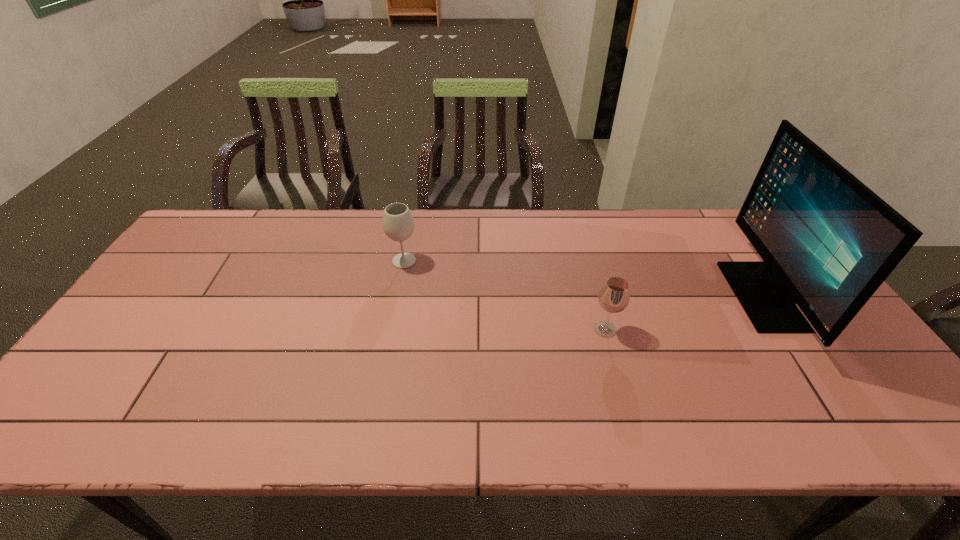
Image resolution: width=960 pixels, height=540 pixels. In order to click on the tallest object in this screenshot , I will do `click(828, 242)`.

Where is `the rightmost object`? The width and height of the screenshot is (960, 540). the rightmost object is located at coordinates (828, 242).

This screenshot has height=540, width=960. Find the location of `the farther wineglass`. the farther wineglass is located at coordinates (398, 224).

Find the location of a particular element. the leftmost object is located at coordinates (398, 224).

Identify the location of the right wineglass. (614, 297).

Where is `the shortest object`? The width and height of the screenshot is (960, 540). the shortest object is located at coordinates (614, 297).

Where is `blank space located 0.360m on the screen side of the monitor`? This screenshot has height=540, width=960. blank space located 0.360m on the screen side of the monitor is located at coordinates (609, 296).

Locate an element on the screen. This screenshot has width=960, height=540. free location located 0.300m on the screen side of the monitor is located at coordinates (630, 296).

Find the location of a particular element. The width and height of the screenshot is (960, 540). free space located on the screen side of the monitor is located at coordinates (676, 296).

At what (x,y) coordinates should I click in order to perform the action: click on free point located 0.200m on the back of the farther wineglass. Please return your answer as a coordinate pair (x, y). The image size is (960, 540). Looking at the image, I should click on (413, 215).